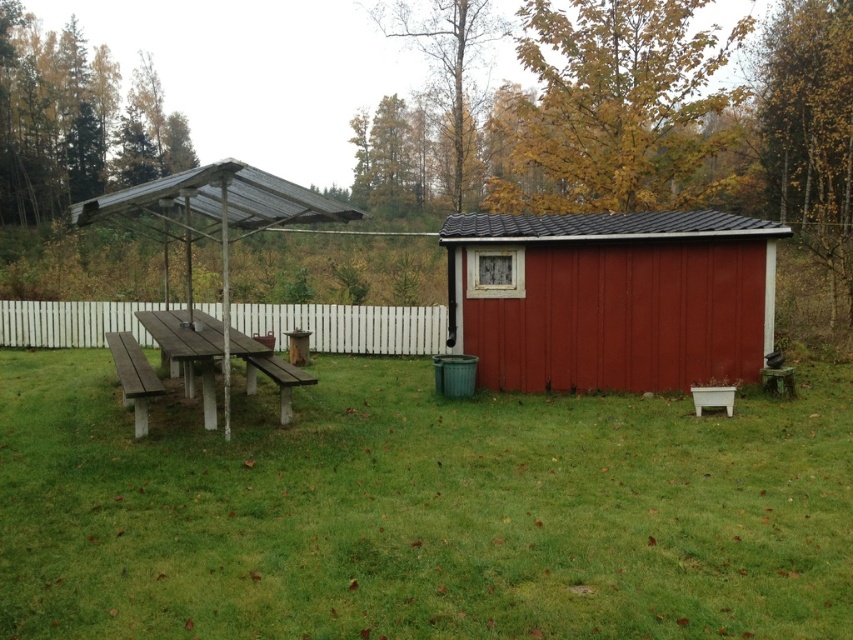
Question: Which object is the farthest from the green grass at center?

Choices:
 (A) white wooden fence at center
 (B) wooden picnic table at left
 (C) wooden bench at left

Answer: (A)

Question: Among these objects, which one is nearest to the camera?

Choices:
 (A) green grass at center
 (B) wooden bench at left
 (C) wooden picnic table at left
 (D) wooden bench at center

Answer: (A)

Question: Is wooden picnic table at left to the left of wooden bench at left from the viewer's perspective?

Choices:
 (A) no
 (B) yes

Answer: (A)

Question: Among these objects, which one is farthest from the camera?

Choices:
 (A) green grass at center
 (B) wooden bench at left
 (C) wooden bench at center
 (D) white wooden fence at center

Answer: (D)

Question: Can you confirm if white wooden fence at center is thinner than wooden bench at center?

Choices:
 (A) yes
 (B) no

Answer: (A)

Question: Can you confirm if matte red shed at center right is positioned below wooden bench at center?

Choices:
 (A) no
 (B) yes

Answer: (A)